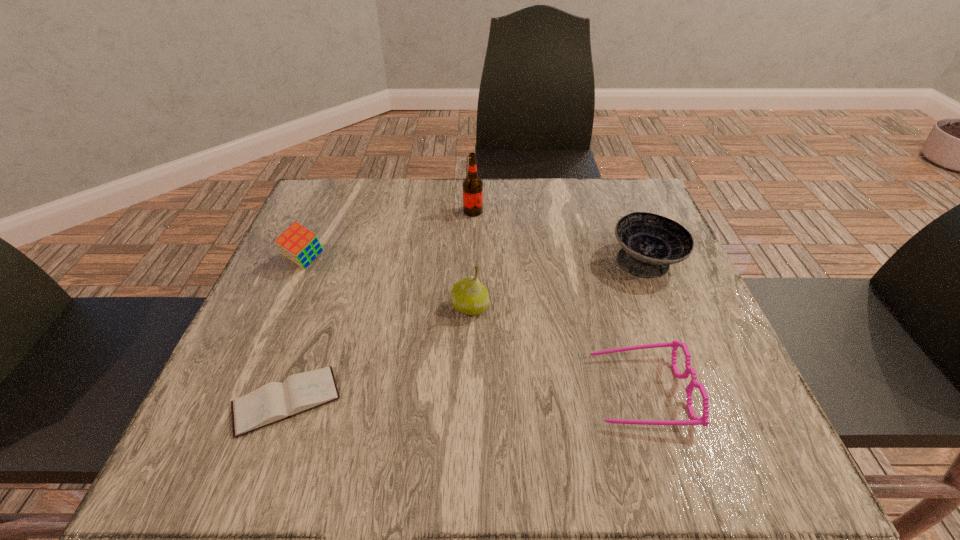
Where is `the tallest object`? The image size is (960, 540). the tallest object is located at coordinates (472, 185).

The image size is (960, 540). Find the location of `the farthest object`. the farthest object is located at coordinates (472, 185).

The width and height of the screenshot is (960, 540). Find the location of `the second tallest object`. the second tallest object is located at coordinates (469, 296).

This screenshot has height=540, width=960. In order to click on pear in this screenshot , I will do `click(469, 296)`.

At what (x,y) coordinates should I click in order to perform the action: click on cube. Please return your answer as a coordinate pair (x, y). Looking at the image, I should click on (298, 244).

Find the location of `bowl`. bowl is located at coordinates (650, 243).

At what (x,y) coordinates should I click in order to perform the action: click on spectacles. Please return your answer as a coordinate pair (x, y). Image resolution: width=960 pixels, height=540 pixels. Looking at the image, I should click on (695, 420).

Where is `the shortest object`? the shortest object is located at coordinates (273, 402).

Locate an element on the screen. vacant region located on the left of the farthest object is located at coordinates (349, 211).

Find the location of a particular element. vacant region located 0.370m on the right of the fourth farthest object is located at coordinates (672, 307).